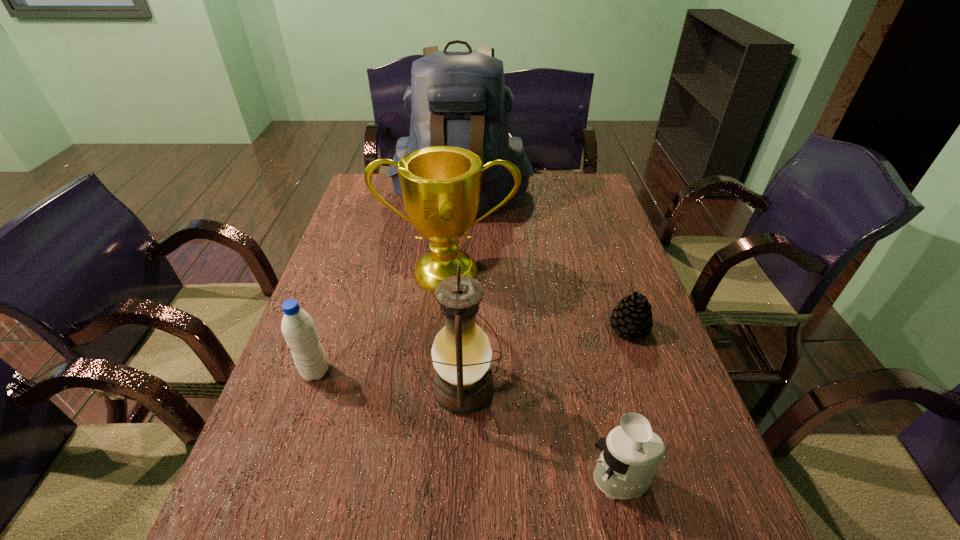
Where is `backpack`? The width and height of the screenshot is (960, 540). backpack is located at coordinates (459, 99).

Image resolution: width=960 pixels, height=540 pixels. Find the location of `the tallest object`. the tallest object is located at coordinates (459, 99).

The height and width of the screenshot is (540, 960). Identify the location of the fifth nearest object. click(x=441, y=186).

Where is `oil lamp`? The image size is (960, 540). oil lamp is located at coordinates (461, 353).

You are a GUI agent. You are given a task and a screenshot of the screen. Output one action in this format:
    pyautogui.click(x=<x>, y=<y>)
    Task: Click on the water bottle
    The image size is (960, 540).
    Given the screenshot: What is the action you would take?
    pyautogui.click(x=298, y=328)

At what (x,y) coordinates should I click in order to perform the action: click on the nearest object. Please return your answer as a coordinate pair (x, y). Looking at the image, I should click on (631, 454).

Identify the location of juicer. The width and height of the screenshot is (960, 540). (631, 454).

At what (x,y) coordinates should I click in order to perform the action: click on the shortest object. Please return your answer as a coordinate pair (x, y). Image resolution: width=960 pixels, height=540 pixels. Looking at the image, I should click on (632, 317).

You are a GUI agent. You are given a task and a screenshot of the screen. Output one action in this format:
    pyautogui.click(x=<x>, y=<y>)
    Task: Click on the fourth nearest object
    Image resolution: width=960 pixels, height=540 pixels.
    Given the screenshot: What is the action you would take?
    pyautogui.click(x=632, y=317)

Locate an element on the screen. The width and height of the screenshot is (960, 540). free point located 0.280m at the front pocket of the backpack is located at coordinates (456, 278).